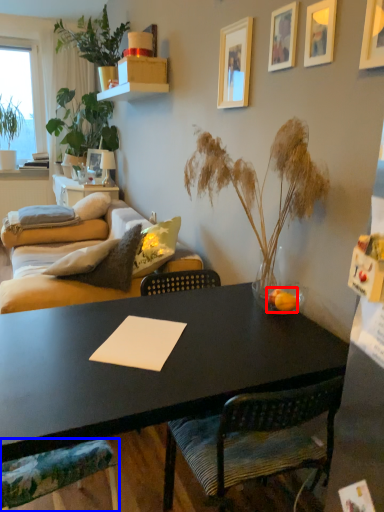
Question: Which of the following is the closest to the observer, fruit (highlighted by a red box) or chair (highlighted by a blue box)?

Choices:
 (A) fruit
 (B) chair

Answer: (B)